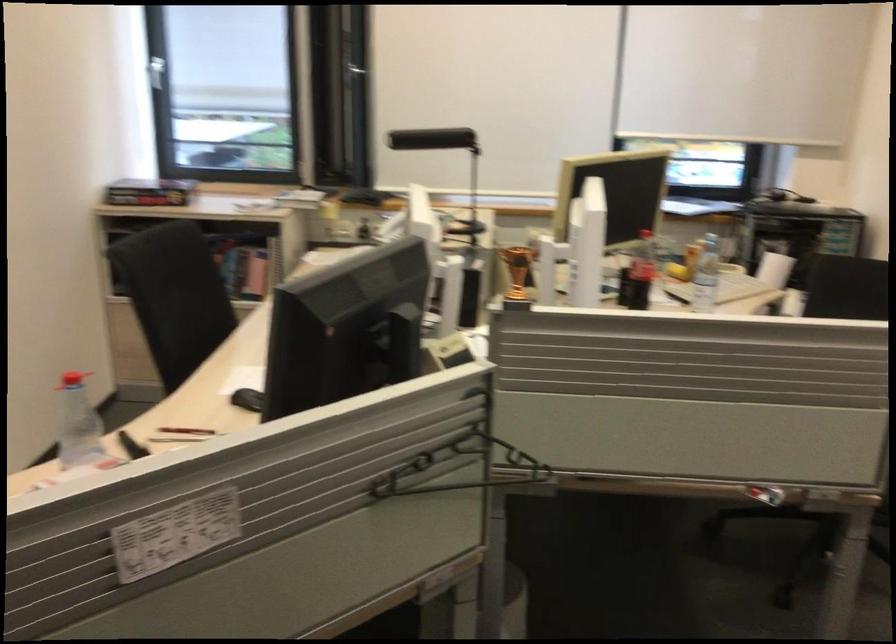
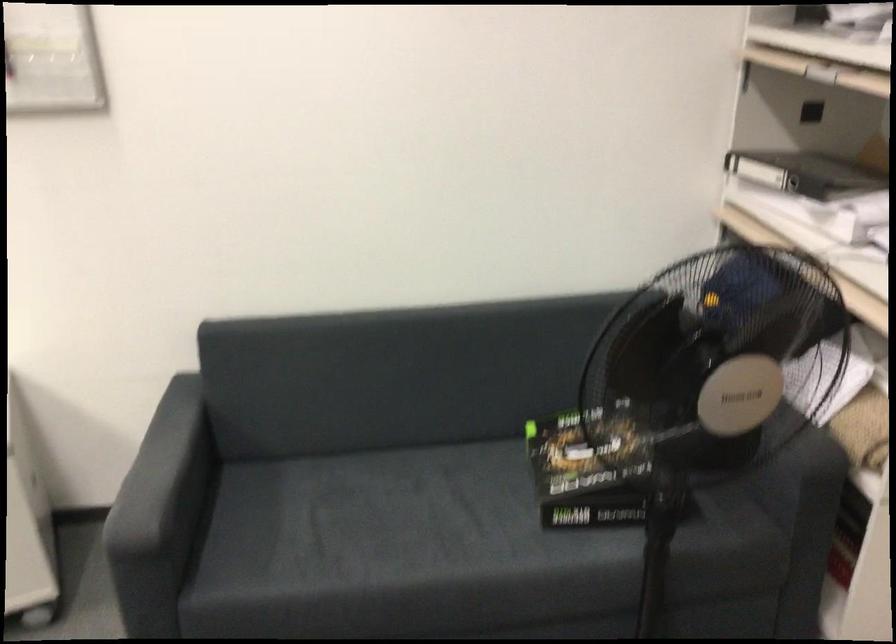
The images are taken continuously from a first-person perspective. In which direction is your viewpoint rotating?

The camera rotated toward right-down.